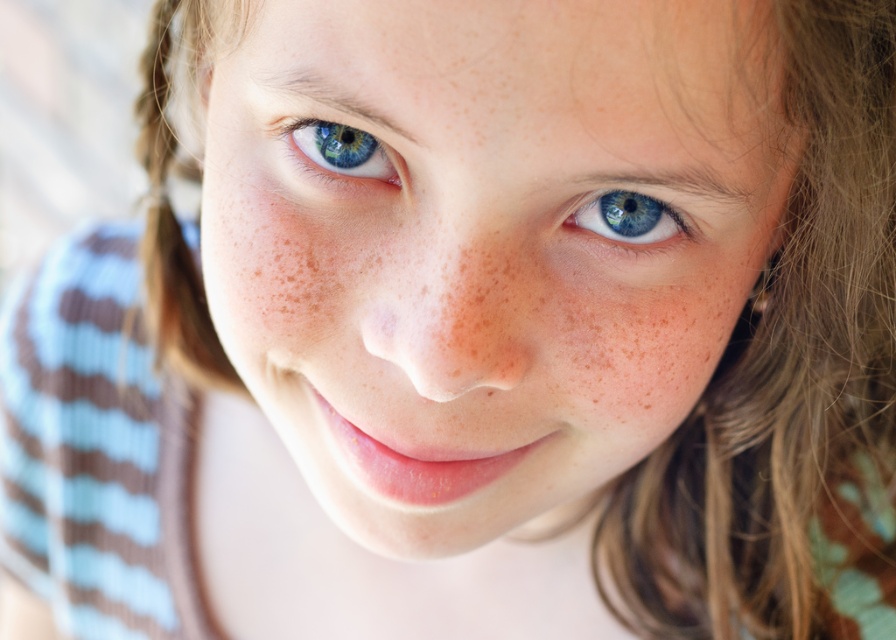
Question: Observing the image, what is the correct spatial positioning of blue glossy eye at upper left in reference to blue glossy eye at center?

Choices:
 (A) right
 (B) left

Answer: (B)

Question: Does blue glossy eye at upper left appear over blue glossy eye at center?

Choices:
 (A) no
 (B) yes

Answer: (B)

Question: Considering the relative positions of smooth skin face at center and blue glossy eye at center in the image provided, where is smooth skin face at center located with respect to blue glossy eye at center?

Choices:
 (A) right
 (B) left

Answer: (B)

Question: Which of these objects is positioned closest to the blue glossy eye at center?

Choices:
 (A) blue glossy eye at upper left
 (B) smooth skin face at center

Answer: (B)

Question: Which object is farther from the camera taking this photo?

Choices:
 (A) blue glossy eye at upper left
 (B) smooth skin face at center

Answer: (A)

Question: Which object is the farthest from the blue glossy eye at upper left?

Choices:
 (A) blue glossy eye at center
 (B) smooth skin face at center

Answer: (A)